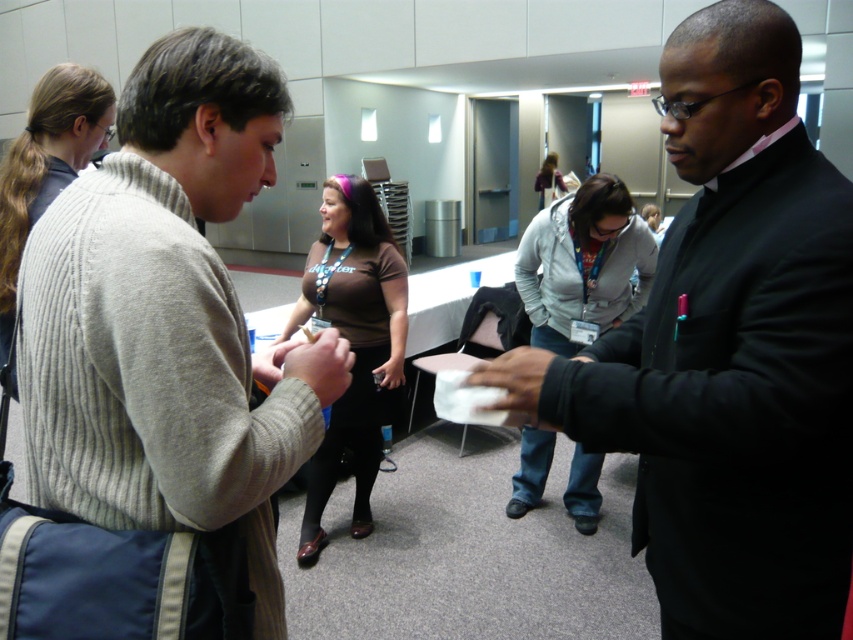
Does black matte suit at center come in front of matte skin hand at center?

Yes.

Who is shorter, black matte suit at center or matte skin hand at center?

With less height is matte skin hand at center.

Identify the location of black matte suit at center. This screenshot has height=640, width=853. (729, 352).

At what (x,y) coordinates should I click in order to perform the action: click on black matte suit at center. Please return your answer as a coordinate pair (x, y). The height and width of the screenshot is (640, 853). Looking at the image, I should click on (729, 352).

Who is higher up, black matte suit at center or brown matte shirt at center?

Positioned higher is black matte suit at center.

From the picture: Which is more to the right, black matte suit at center or brown matte shirt at center?

black matte suit at center is more to the right.

Between point (679, 26) and point (312, 541), which one is positioned in front?

Point (679, 26) is in front.

Where is `black matte suit at center`? The image size is (853, 640). black matte suit at center is located at coordinates (729, 352).

From the picture: Who is positioned more to the right, ribbed gray sweater at center or brown matte shirt at center?

Positioned to the right is ribbed gray sweater at center.

Is ribbed gray sweater at center below brown matte shirt at center?

Incorrect, ribbed gray sweater at center is not positioned below brown matte shirt at center.

The width and height of the screenshot is (853, 640). Identify the location of ribbed gray sweater at center. (163, 317).